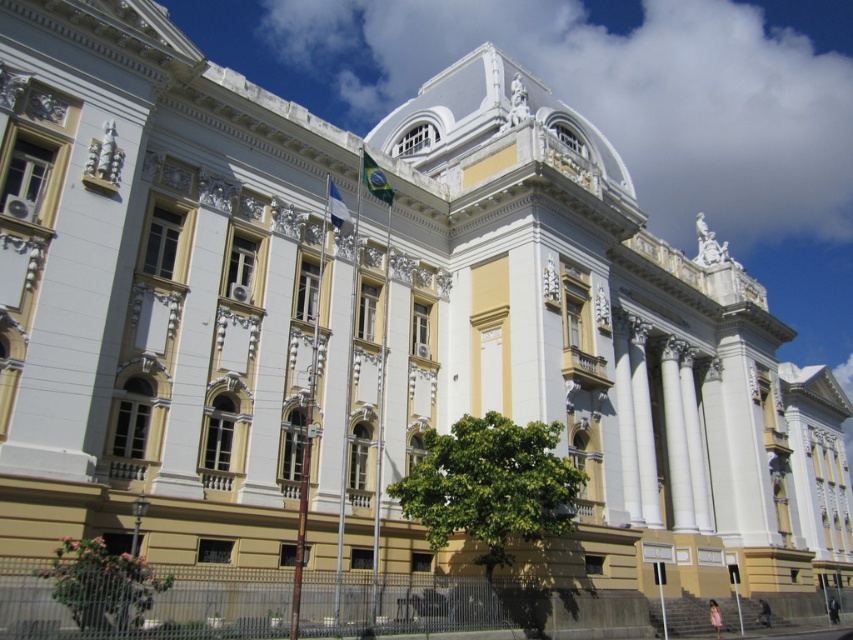
Is green leafy tree at center bigger than green leafy tree at lower left?

Yes, green leafy tree at center is bigger than green leafy tree at lower left.

Who is positioned more to the right, green leafy tree at center or green leafy tree at lower left?

green leafy tree at center is more to the right.

Does point (526, 444) come closer to viewer compared to point (148, 595)?

No, it is not.

You are a GUI agent. You are given a task and a screenshot of the screen. Output one action in this format:
    pyautogui.click(x=<x>, y=<y>)
    Task: Click on the green leafy tree at center
    
    Given the screenshot: What is the action you would take?
    490,484